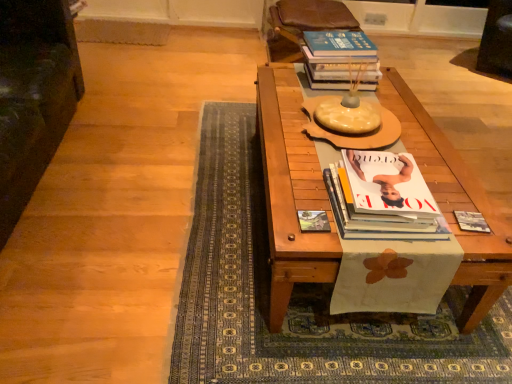
Question: Is blue hardcover book at upper right, the third book ordered from the bottom, shorter than dark green fabric armchair at left, marked as the second armchair in a back-to-front arrangement?

Choices:
 (A) yes
 (B) no

Answer: (A)

Question: From the image's perspective, is blue hardcover book at upper right, the third book ordered from the bottom, under dark green fabric armchair at left, marked as the second armchair in a back-to-front arrangement?

Choices:
 (A) no
 (B) yes

Answer: (A)

Question: Is blue hardcover book at upper right, the third book ordered from the bottom, to the right of dark green fabric armchair at left, placed as the first armchair when sorted from front to back, from the viewer's perspective?

Choices:
 (A) yes
 (B) no

Answer: (A)

Question: Does blue hardcover book at upper right, the 1th book in the top-to-bottom sequence, come in front of dark green fabric armchair at left, the 1th armchair in the left-to-right sequence?

Choices:
 (A) yes
 (B) no

Answer: (B)

Question: Is blue hardcover book at upper right, the third book ordered from the bottom, oriented towards dark green fabric armchair at left, the second armchair when ordered from right to left?

Choices:
 (A) yes
 (B) no

Answer: (A)

Question: Can you confirm if blue hardcover book at upper right, the third book ordered from the bottom, is smaller than dark green fabric armchair at left, marked as the second armchair in a back-to-front arrangement?

Choices:
 (A) yes
 (B) no

Answer: (A)

Question: Considering the relative sizes of matte black book at right, marked as the third book in a top-to-bottom arrangement, and white glossy magazine at center, acting as the 2th book starting from the top, in the image provided, is matte black book at right, marked as the third book in a top-to-bottom arrangement, wider than white glossy magazine at center, acting as the 2th book starting from the top,?

Choices:
 (A) yes
 (B) no

Answer: (B)

Question: Is matte black book at right, which is the 2th book in front-to-back order, directly adjacent to white glossy magazine at center, which is counted as the 2th book, starting from the bottom?

Choices:
 (A) yes
 (B) no

Answer: (B)

Question: Can you confirm if matte black book at right, which is the 2th book in front-to-back order, is smaller than white glossy magazine at center, which is counted as the 2th book, starting from the bottom?

Choices:
 (A) yes
 (B) no

Answer: (A)

Question: From the image's perspective, is matte black book at right, the 2th book when ordered from back to front, located above white glossy magazine at center, which is counted as the 2th book, starting from the bottom?

Choices:
 (A) no
 (B) yes

Answer: (A)

Question: From a real-world perspective, does matte black book at right, which is the 2th book in front-to-back order, stand above white glossy magazine at center, the third book from the back?

Choices:
 (A) yes
 (B) no

Answer: (B)

Question: Is there a large distance between matte black book at right, the 2th book when ordered from back to front, and white glossy magazine at center, the first book in the front-to-back sequence?

Choices:
 (A) no
 (B) yes

Answer: (A)

Question: Can you confirm if white glossy magazine at center, acting as the 2th book starting from the top, is thinner than brown leather armchair at upper center, which is counted as the 2th armchair, starting from the front?

Choices:
 (A) no
 (B) yes

Answer: (B)